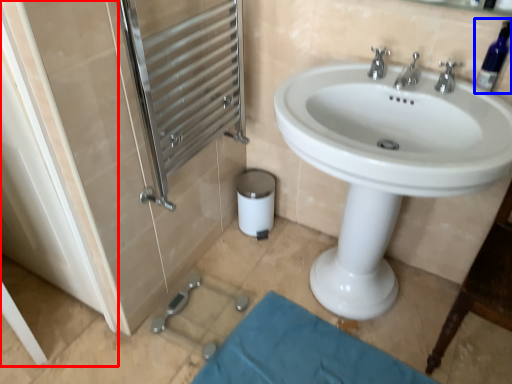
Question: Which object is further to the camera taking this photo, screen door (highlighted by a red box) or bottle (highlighted by a blue box)?

Choices:
 (A) screen door
 (B) bottle

Answer: (B)